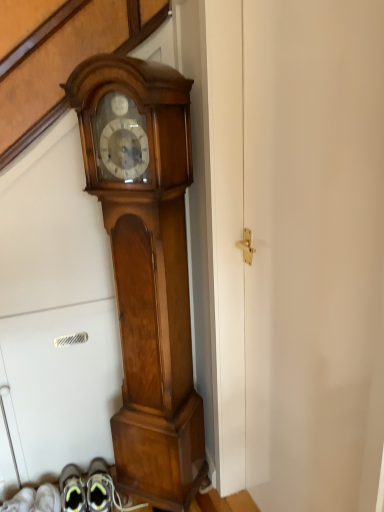
Question: From a real-world perspective, does white matte door at center sit lower than polished wood grandfather clock at center?

Choices:
 (A) no
 (B) yes

Answer: (A)

Question: From the image's perspective, is white matte door at center on top of polished wood grandfather clock at center?

Choices:
 (A) yes
 (B) no

Answer: (B)

Question: Considering the relative positions of white matte door at center and polished wood grandfather clock at center in the image provided, is white matte door at center to the right of polished wood grandfather clock at center from the viewer's perspective?

Choices:
 (A) no
 (B) yes

Answer: (B)

Question: Is white matte door at center far away from polished wood grandfather clock at center?

Choices:
 (A) yes
 (B) no

Answer: (B)

Question: Does white matte door at center have a lesser width compared to polished wood grandfather clock at center?

Choices:
 (A) no
 (B) yes

Answer: (B)

Question: Is white matte door at center taller than polished wood grandfather clock at center?

Choices:
 (A) yes
 (B) no

Answer: (A)

Question: Is polished wood grandfather clock at center in contact with white matte door at center?

Choices:
 (A) yes
 (B) no

Answer: (B)

Question: Is polished wood grandfather clock at center at the right side of white matte door at center?

Choices:
 (A) yes
 (B) no

Answer: (B)

Question: Is polished wood grandfather clock at center taller than white matte door at center?

Choices:
 (A) no
 (B) yes

Answer: (A)

Question: From the image's perspective, does polished wood grandfather clock at center appear higher than white matte door at center?

Choices:
 (A) yes
 (B) no

Answer: (A)

Question: Is polished wood grandfather clock at center shorter than white matte door at center?

Choices:
 (A) yes
 (B) no

Answer: (A)

Question: Is polished wood grandfather clock at center turned away from white matte door at center?

Choices:
 (A) yes
 (B) no

Answer: (B)

Question: Based on their sizes in the image, would you say polished wood grandfather clock at center is bigger or smaller than white matte door at center?

Choices:
 (A) small
 (B) big

Answer: (A)